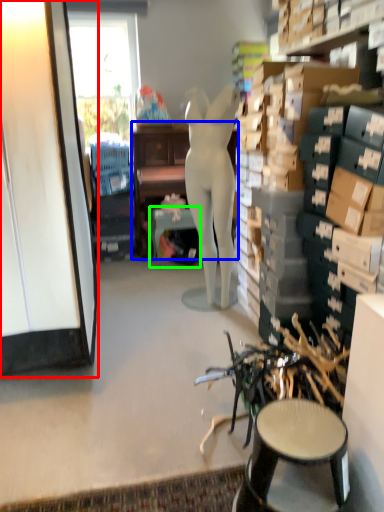
Question: Estimate the real-world distances between objects in this image. Which object is closer to cabinetry (highlighted by a red box), desk (highlighted by a blue box) or table (highlighted by a green box)?

Choices:
 (A) desk
 (B) table

Answer: (B)